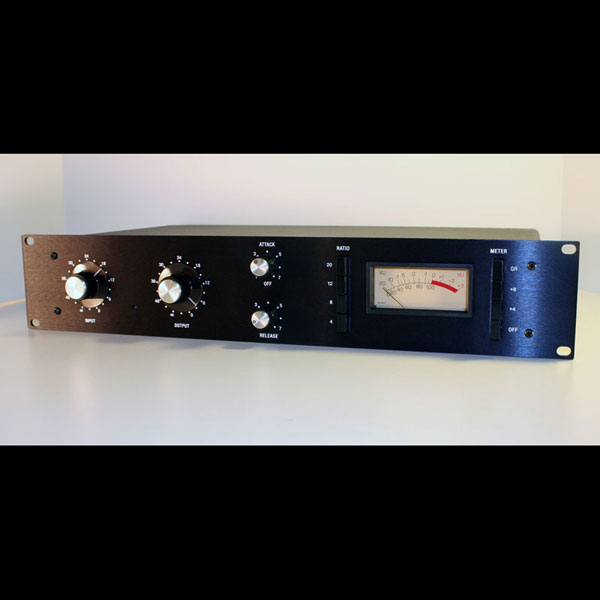
In order to click on faceplate in this screenshot , I will do `click(394, 331)`.